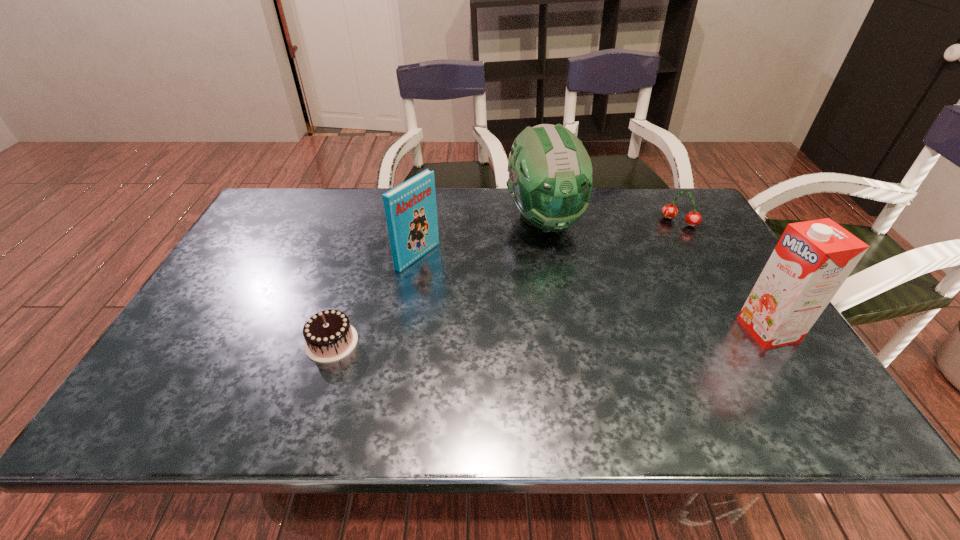
You are a GUI agent. You are given a task and a screenshot of the screen. Output one action in this format:
    pyautogui.click(x=<x>, y=<y>)
    Task: Click on the vacant spot on the desktop that is between the chocolate cake and the carton and is positioned with stems pointing upwards on the fourth tallest object
    This screenshot has height=540, width=960.
    Given the screenshot: What is the action you would take?
    pyautogui.click(x=595, y=335)

At what (x,y) coordinates should I click in order to perform the action: click on vacant space on the desktop that is between the leftmost object and the carton and is positioned on the front cover of the third tallest object. Please return your answer as a coordinate pair (x, y). Image resolution: width=960 pixels, height=540 pixels. Looking at the image, I should click on (570, 335).

This screenshot has height=540, width=960. Find the location of `free spot on the desktop that is between the chocolate cake and the carton and is positioned on the visor of the third object from left to right`. free spot on the desktop that is between the chocolate cake and the carton and is positioned on the visor of the third object from left to right is located at coordinates (605, 334).